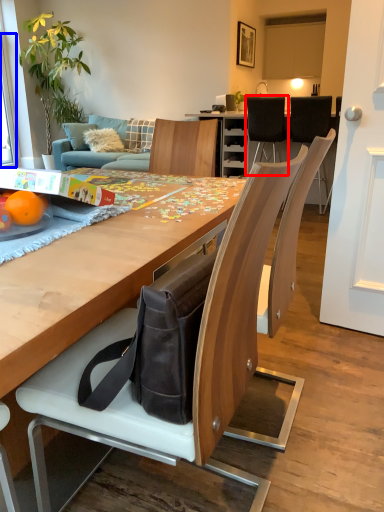
Question: Which object is closer to the camera taking this photo, chair (highlighted by a red box) or window screen (highlighted by a blue box)?

Choices:
 (A) chair
 (B) window screen

Answer: (A)